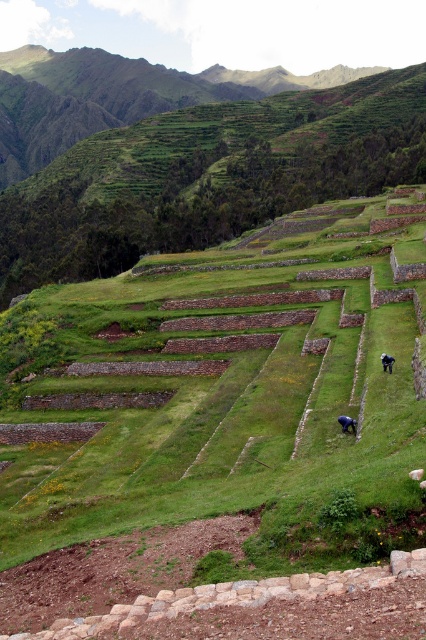
Question: Considering the relative positions of blue fabric person at lower right and black fabric person at lower right in the image provided, where is blue fabric person at lower right located with respect to black fabric person at lower right?

Choices:
 (A) below
 (B) above

Answer: (A)

Question: Which of the following is the farthest from the observer?

Choices:
 (A) black fabric person at lower right
 (B) blue fabric person at lower right

Answer: (A)

Question: Is blue fabric person at lower right in front of black fabric person at lower right?

Choices:
 (A) no
 (B) yes

Answer: (B)

Question: Which object appears closest to the camera in this image?

Choices:
 (A) black fabric person at lower right
 (B) blue fabric person at lower right

Answer: (B)

Question: Does blue fabric person at lower right come in front of black fabric person at lower right?

Choices:
 (A) yes
 (B) no

Answer: (A)